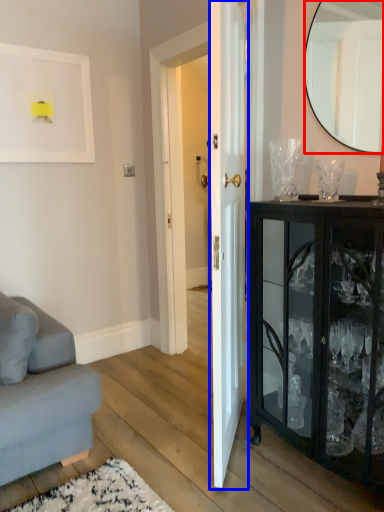
Question: Which object appears closest to the camera in this image, mirror (highlighted by a red box) or door (highlighted by a blue box)?

Choices:
 (A) mirror
 (B) door

Answer: (B)